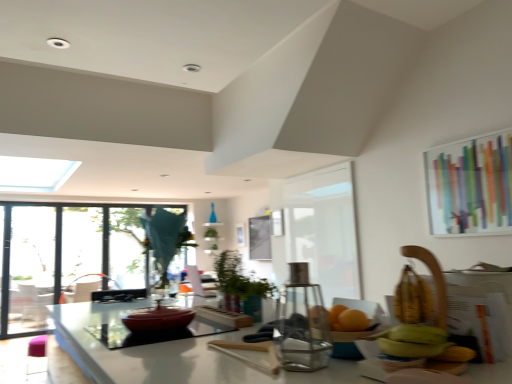
Question: Is clear glass screen door at left, the second screen door when ordered from front to back, outside green matte plant at center?

Choices:
 (A) yes
 (B) no

Answer: (A)

Question: Does clear glass screen door at left, marked as the first screen door in a left-to-right arrangement, have a greater height compared to green matte plant at center?

Choices:
 (A) yes
 (B) no

Answer: (A)

Question: Can you confirm if clear glass screen door at left, which is the 2th screen door from right to left, is thinner than green matte plant at center?

Choices:
 (A) yes
 (B) no

Answer: (B)

Question: Does clear glass screen door at left, which is the first screen door from back to front, lie behind green matte plant at center?

Choices:
 (A) no
 (B) yes

Answer: (B)

Question: Considering the relative sizes of clear glass screen door at left, which is the first screen door from back to front, and green matte plant at center in the image provided, is clear glass screen door at left, which is the first screen door from back to front, wider than green matte plant at center?

Choices:
 (A) yes
 (B) no

Answer: (A)

Question: From the image's perspective, is clear glass screen door at left, which is the 2th screen door from right to left, beneath green matte plant at center?

Choices:
 (A) no
 (B) yes

Answer: (B)

Question: Is colorful glass window screen at upper right turned away from white matte screen door at center, which is counted as the second screen door, starting from the back?

Choices:
 (A) yes
 (B) no

Answer: (B)

Question: Is colorful glass window screen at upper right not inside white matte screen door at center, placed as the second screen door when sorted from left to right?

Choices:
 (A) yes
 (B) no

Answer: (A)

Question: Is the depth of colorful glass window screen at upper right less than that of white matte screen door at center, placed as the second screen door when sorted from left to right?

Choices:
 (A) no
 (B) yes

Answer: (B)

Question: From the image's perspective, is colorful glass window screen at upper right below white matte screen door at center, the 1th screen door viewed from the right?

Choices:
 (A) yes
 (B) no

Answer: (B)

Question: Can you confirm if colorful glass window screen at upper right is bigger than white matte screen door at center, the 1th screen door viewed from the front?

Choices:
 (A) no
 (B) yes

Answer: (A)

Question: From a real-world perspective, does colorful glass window screen at upper right stand above white matte screen door at center, the 1th screen door viewed from the front?

Choices:
 (A) no
 (B) yes

Answer: (B)

Question: Does clear glass screen door at left, marked as the first screen door in a left-to-right arrangement, touch transparent glass window at left?

Choices:
 (A) yes
 (B) no

Answer: (B)